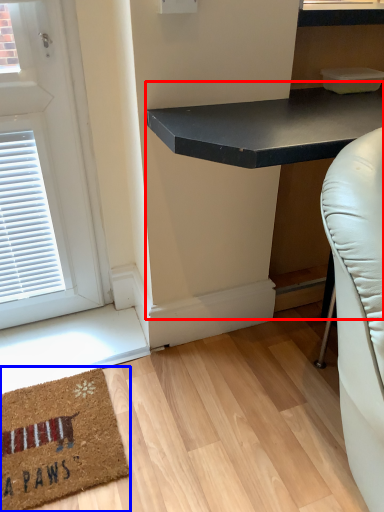
Question: Which object appears farthest to the camera in this image, table (highlighted by a red box) or mat (highlighted by a blue box)?

Choices:
 (A) table
 (B) mat

Answer: (B)